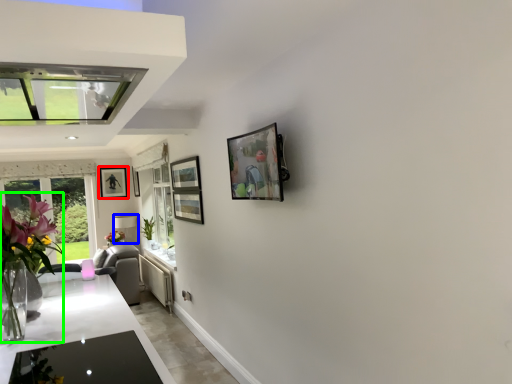
Question: Which object is the closest to the picture frame (highlighted by a red box)? Choose among these: lamp (highlighted by a blue box) or floral arrangement (highlighted by a green box).

Choices:
 (A) lamp
 (B) floral arrangement

Answer: (A)